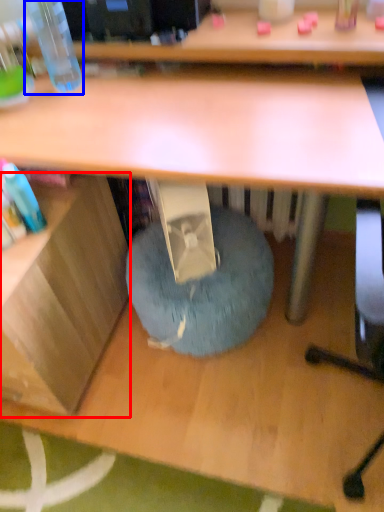
Question: Which object appears closest to the camera in this image, shelf (highlighted by a red box) or bottle (highlighted by a blue box)?

Choices:
 (A) shelf
 (B) bottle

Answer: (A)